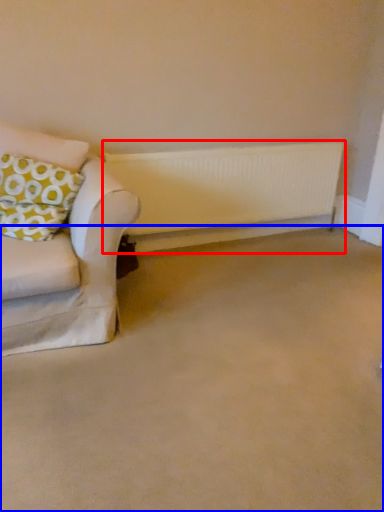
Question: Among these objects, which one is nearest to the camera, radiator (highlighted by a red box) or plain (highlighted by a blue box)?

Choices:
 (A) radiator
 (B) plain

Answer: (B)